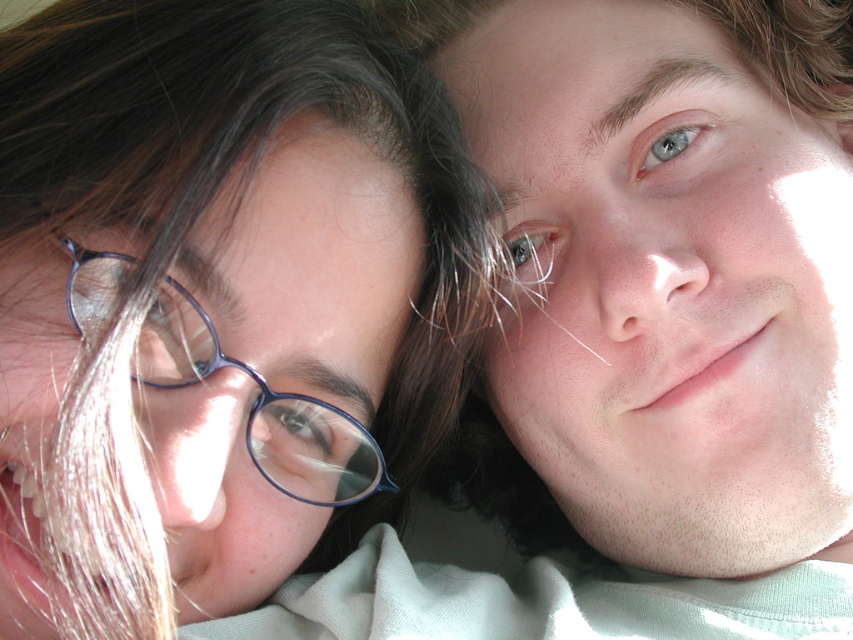
You are a photographer setting up a shot and want to ensure the two glasses in the scene are positioned correctly. Given that the matte blue glasses at center and the blue plastic glasses at left must be spaced exactly 2.5 inches apart for the composition to work, is the current setup correct?

The distance between the matte blue glasses at center and the blue plastic glasses at left is 2.42 inches, which is slightly less than the required 2.5 inches. The current setup is not correct as the glasses are too close together.

You are holding a 12 inch ruler and want to measure the distance between you and the point at coordinates point (79,532). Can you reach it with your ruler?

The point at coordinates point (79,532) is 16.65 inches away from the viewer, so the 12 inch ruler is not long enough to reach it.

You are designing a display case for eyewear and need to arrange the matte blue glasses at center and the blue plastic glasses at left. Given their size difference, which pair should be placed in the larger designated spot?

The matte blue glasses at center should be placed in the larger designated spot since they are larger in size than the blue plastic glasses at left.